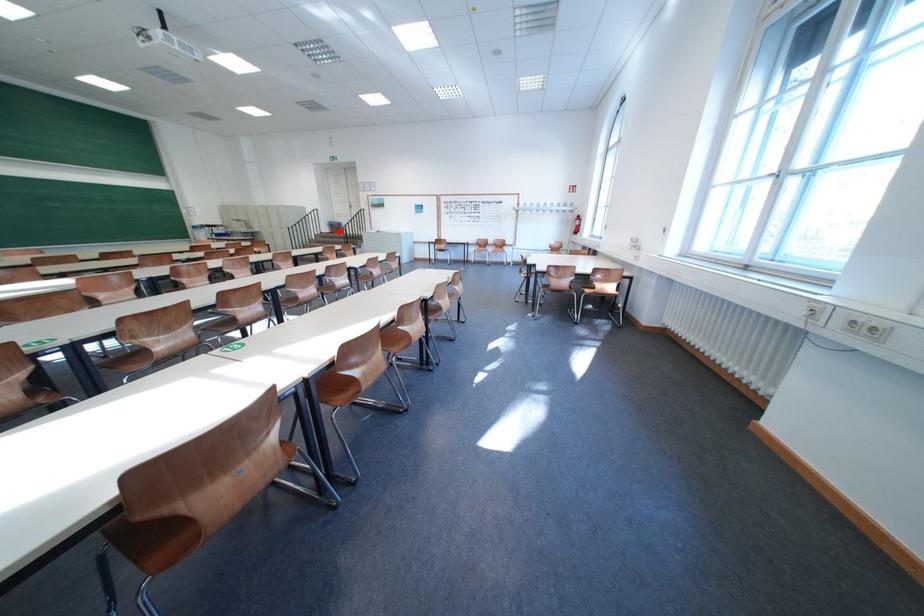
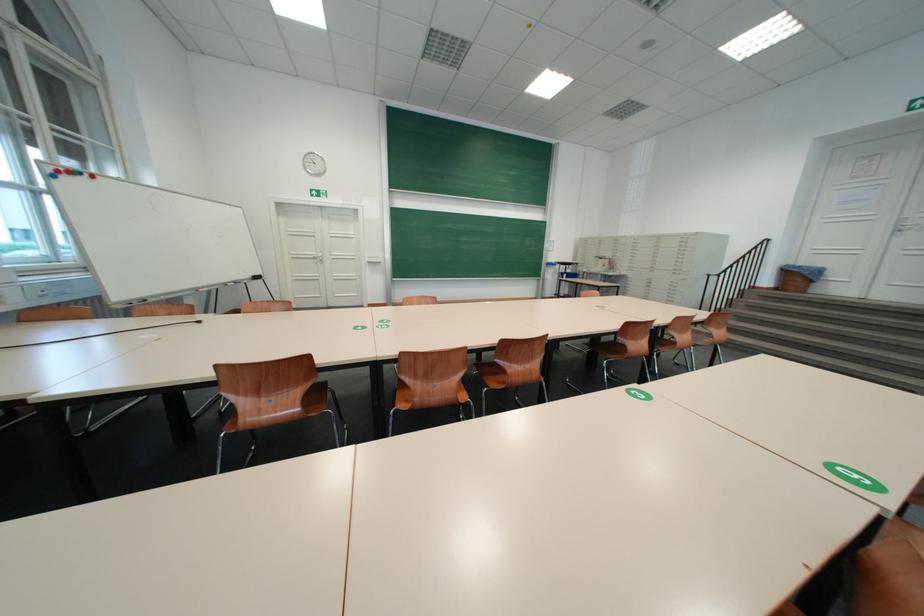
The point at the highlighted location is marked in the first image. Where is the corresponding point in the second image?

(781, 283)